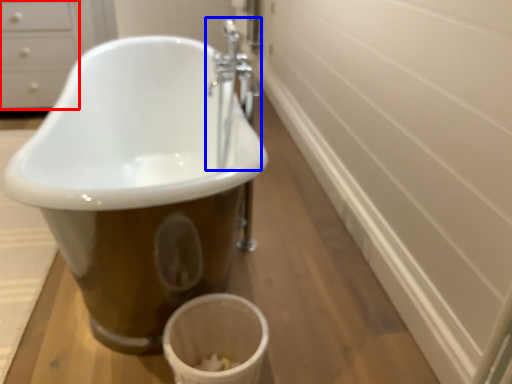
Question: Which point is further to the camera, drawer (highlighted by a red box) or tap (highlighted by a blue box)?

Choices:
 (A) drawer
 (B) tap

Answer: (A)